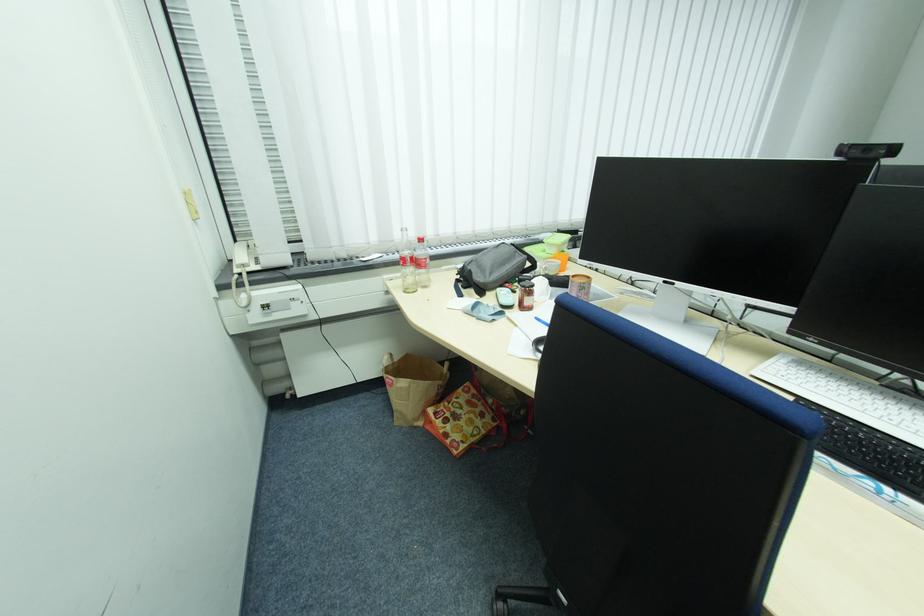
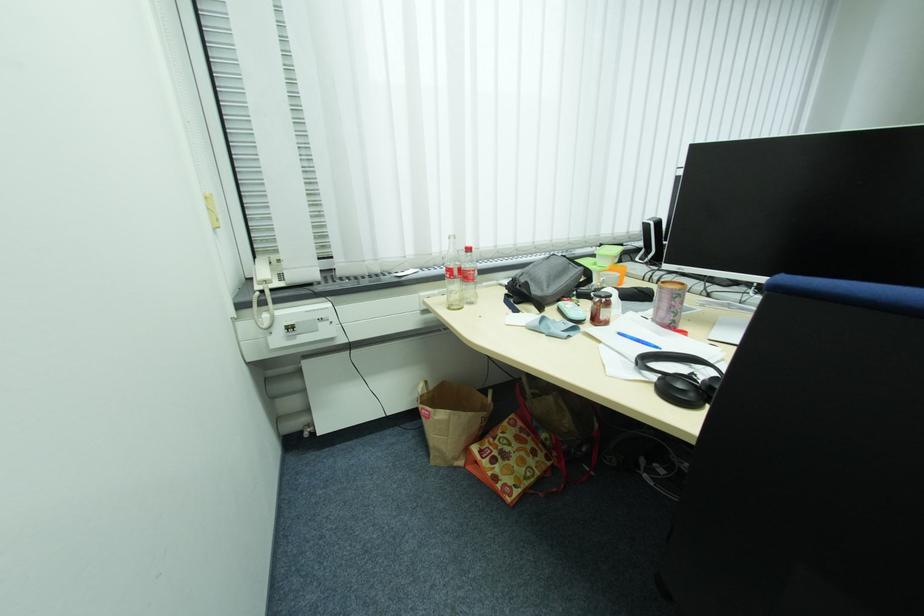
Find the pixel in the second image that matches point 497,274 in the first image.

(554, 286)